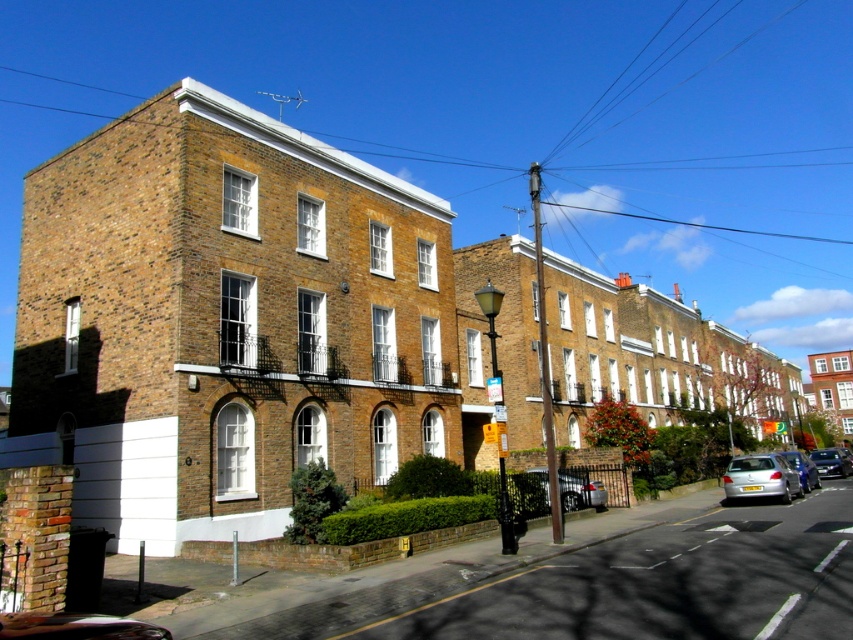
Is shiny silver car at lower right below metallic silver car at lower right?

Actually, shiny silver car at lower right is above metallic silver car at lower right.

Who is shorter, shiny silver car at lower right or metallic silver car at lower right?

With less height is shiny silver car at lower right.

The image size is (853, 640). In order to click on shiny silver car at lower right in this screenshot , I will do `click(579, 492)`.

Between silver metallic car at lower right and metallic silver sedan at lower right, which one has more height?

silver metallic car at lower right is taller.

Is silver metallic car at lower right behind metallic silver sedan at lower right?

No, silver metallic car at lower right is closer to the viewer.

This screenshot has height=640, width=853. I want to click on silver metallic car at lower right, so 759,477.

Is shiny silver car at lower right wider than metallic silver sedan at lower right?

Incorrect, shiny silver car at lower right's width does not surpass metallic silver sedan at lower right's.

Can you confirm if shiny silver car at lower right is smaller than metallic silver sedan at lower right?

Correct, shiny silver car at lower right occupies less space than metallic silver sedan at lower right.

What do you see at coordinates (579, 492) in the screenshot?
I see `shiny silver car at lower right` at bounding box center [579, 492].

The image size is (853, 640). What are the coordinates of `shiny silver car at lower right` in the screenshot? It's located at (579, 492).